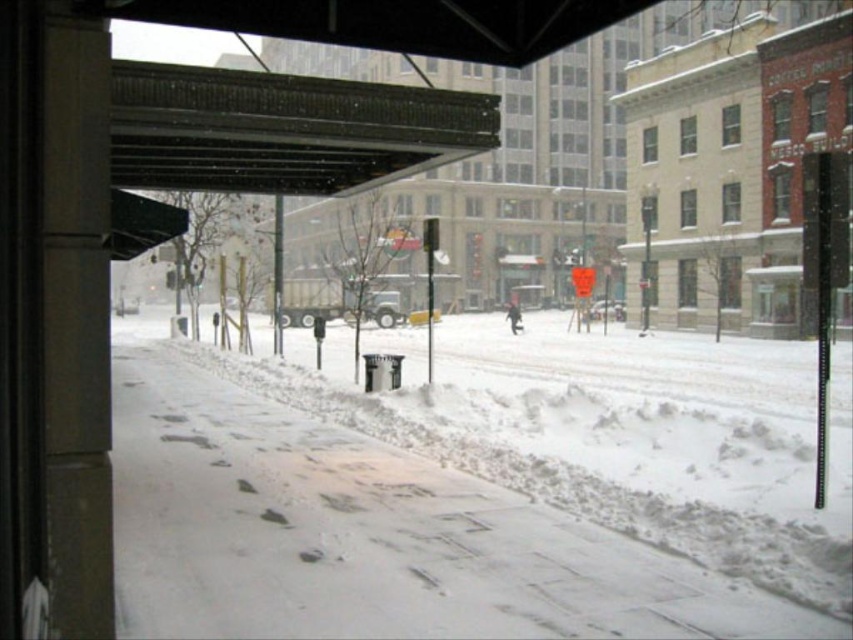
Question: Which object appears closest to the camera in this image?

Choices:
 (A) white snow at lower center
 (B) metallic corrugated roof at upper center

Answer: (B)

Question: Among these points, which one is nearest to the camera?

Choices:
 (A) (270, 134)
 (B) (440, 445)

Answer: (A)

Question: Can you confirm if white snow at lower center is positioned below metallic corrugated roof at upper center?

Choices:
 (A) yes
 (B) no

Answer: (A)

Question: Does white snow at lower center appear over metallic corrugated roof at upper center?

Choices:
 (A) yes
 (B) no

Answer: (B)

Question: Where is white snow at lower center located in relation to metallic corrugated roof at upper center in the image?

Choices:
 (A) below
 (B) above

Answer: (A)